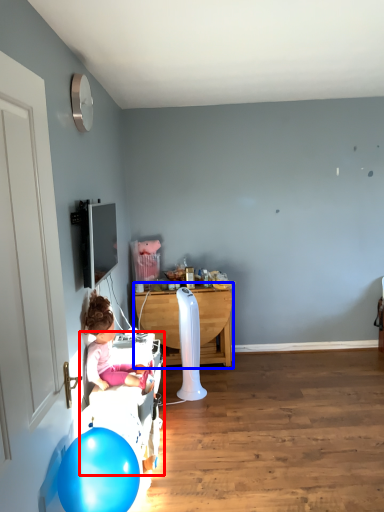
Question: Which object appears closest to the camera in this image, bed frame (highlighted by a red box) or table (highlighted by a blue box)?

Choices:
 (A) bed frame
 (B) table

Answer: (A)